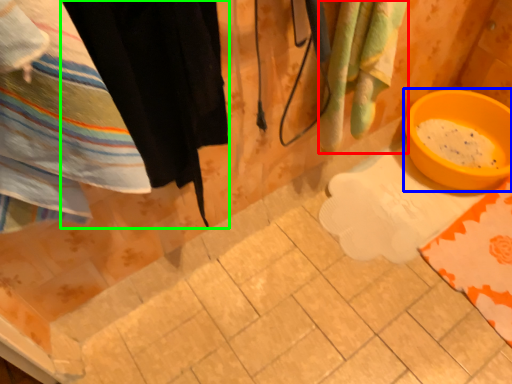
Question: Which object is positioned closest to beach towel (highlighted by a red box)? Select from basin (highlighted by a blue box) and clothing (highlighted by a green box).

Choices:
 (A) basin
 (B) clothing

Answer: (B)